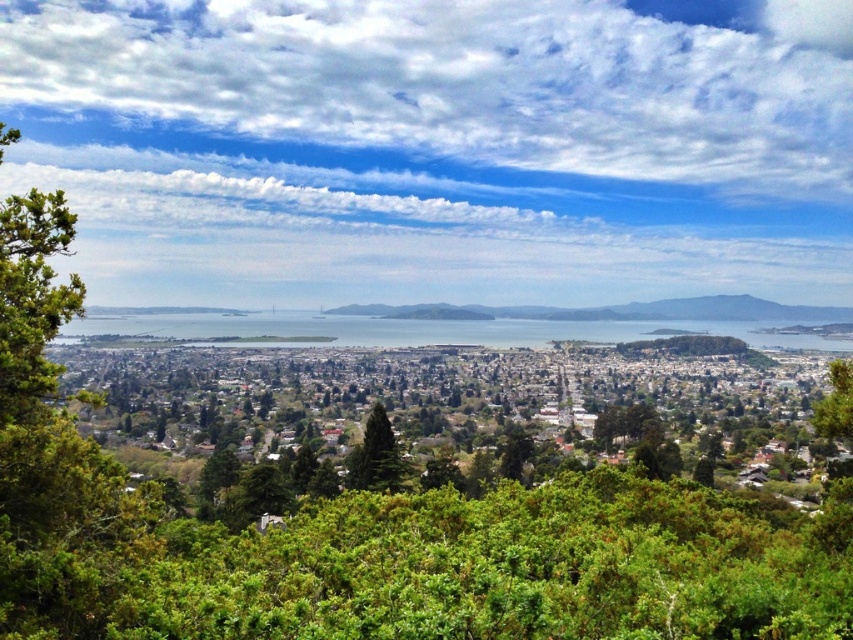
Is point (370, 310) positioned after point (386, 432)?

No, (370, 310) is in front of (386, 432).

Does point (566, 320) lie in front of point (393, 449)?

No, it is not.

Where is `green grassy hill at center`? green grassy hill at center is located at coordinates (612, 310).

Between green matte tree at center and green leafy tree at center, which one is positioned lower?

Positioned lower is green leafy tree at center.

Measure the distance between green matte tree at center and green leafy tree at center.

green matte tree at center is 321.96 feet away from green leafy tree at center.

Which is behind, point (363, 467) or point (515, 472)?

The point (515, 472) is behind.

Identify the location of green matte tree at center. (375, 456).

Between green grassy hill at center and green leafy tree at center, which one has more height?

Standing taller between the two is green leafy tree at center.

Is point (677, 317) positioned before point (519, 476)?

No, (677, 317) is further to viewer.

Image resolution: width=853 pixels, height=640 pixels. I want to click on green grassy hill at center, so click(612, 310).